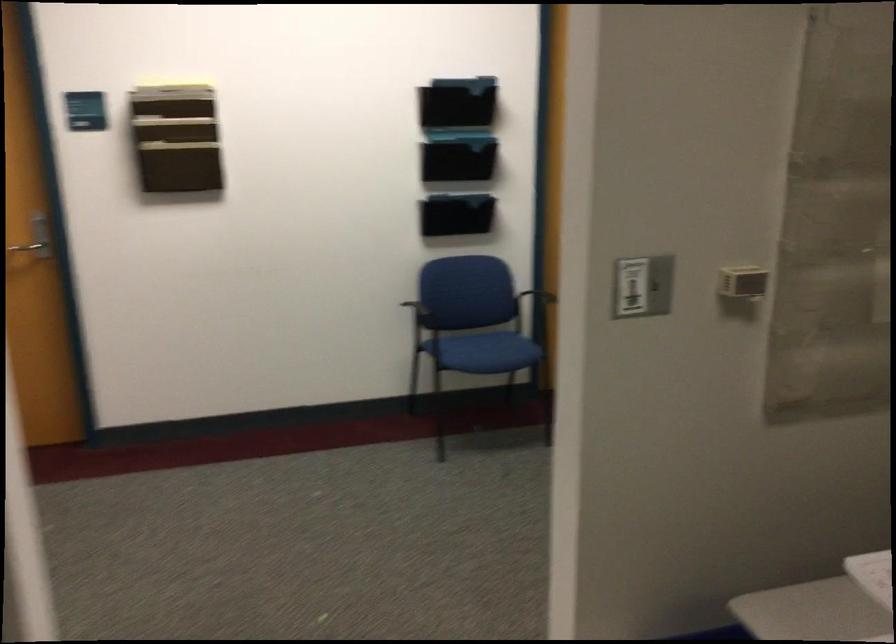
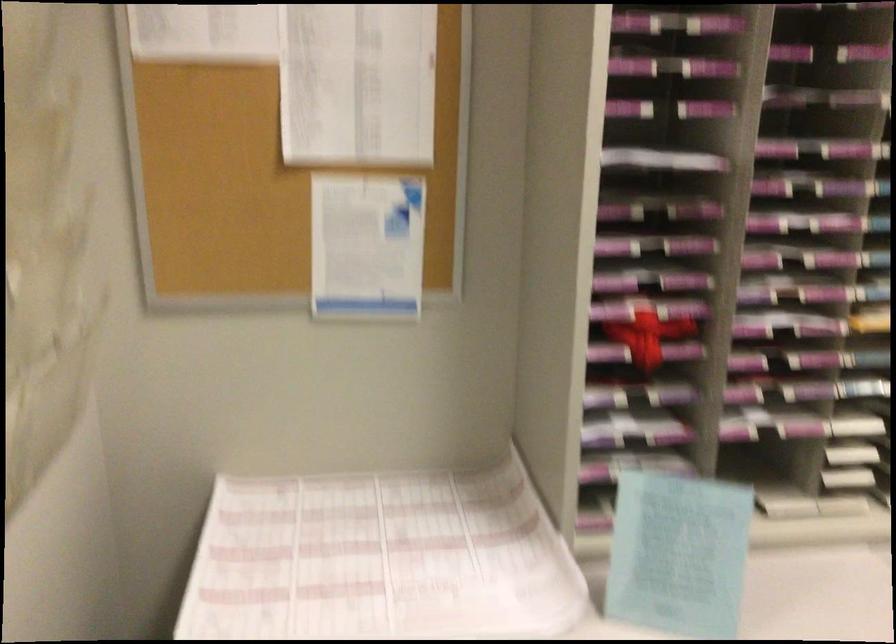
Question: The images are taken continuously from a first-person perspective. In which direction is your viewpoint rotating?

Choices:
 (A) Left
 (B) Right
 (C) Up
 (D) Down

Answer: (B)